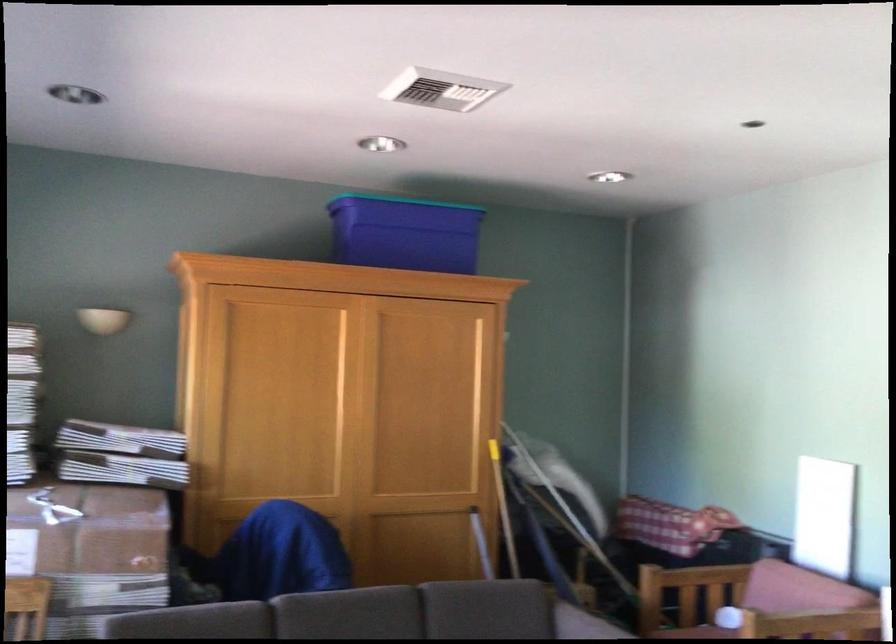
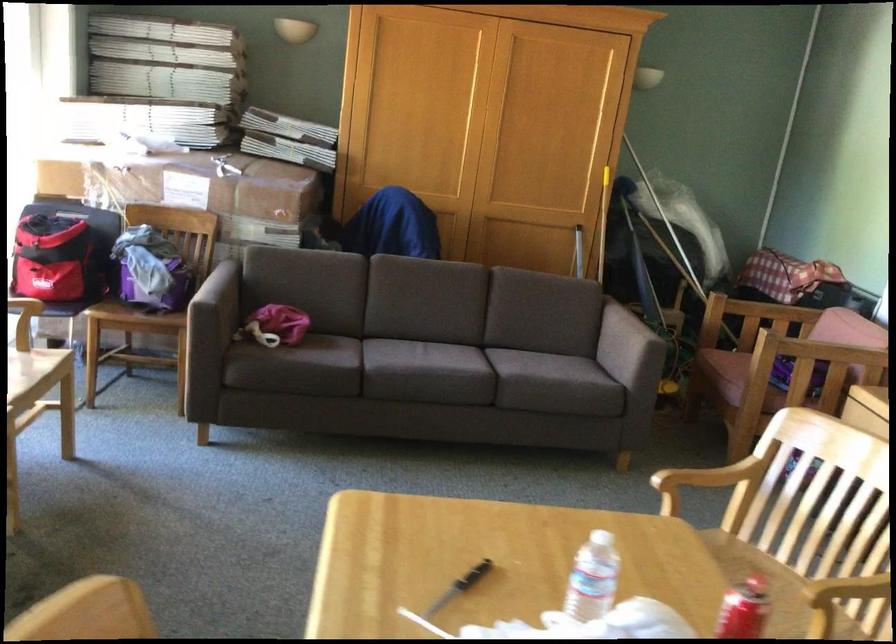
How did the camera likely rotate?

The camera's rotation is toward left-down.